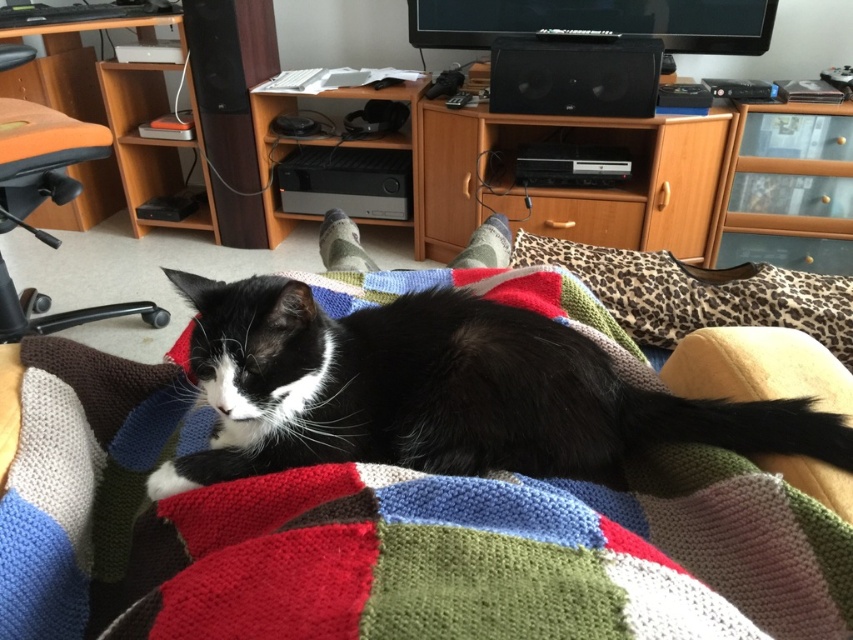
Question: Is black soft fur cat at center smaller than orange fabric computer chair at left?

Choices:
 (A) no
 (B) yes

Answer: (B)

Question: Considering the real-world distances, which object is farthest from the wooden cabinet at center?

Choices:
 (A) orange fabric computer chair at left
 (B) leopard print fabric pillow at lower right
 (C) black soft fur cat at center
 (D) orange wood computer desk at left

Answer: (C)

Question: Which object is the closest to the black soft fur cat at center?

Choices:
 (A) leopard print fabric pillow at lower right
 (B) wooden cabinet at center

Answer: (A)

Question: In this image, where is black soft fur cat at center located relative to orange wood computer desk at left?

Choices:
 (A) below
 (B) above

Answer: (A)

Question: Which object is closer to the camera taking this photo?

Choices:
 (A) orange wood computer desk at left
 (B) orange fabric computer chair at left

Answer: (B)

Question: Is wooden cabinet at center positioned behind leopard print fabric pillow at lower right?

Choices:
 (A) no
 (B) yes

Answer: (B)